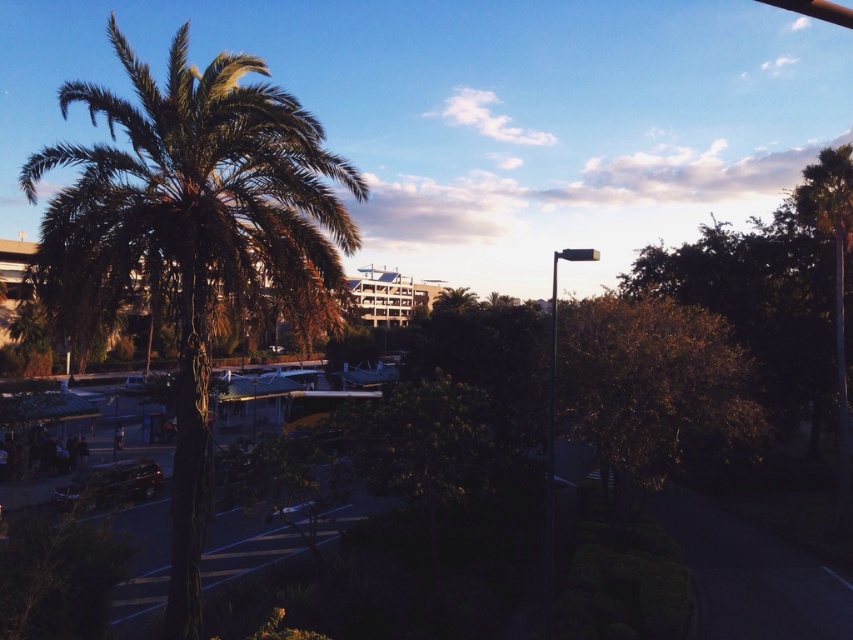
Who is positioned more to the left, green leafy palm tree at left or shiny dark brown car at lower left?

Positioned to the left is green leafy palm tree at left.

Is green leafy palm tree at left positioned before shiny dark brown car at lower left?

Yes.

Is point (287, 198) farther from camera compared to point (68, 483)?

No, it is not.

Identify the location of green leafy palm tree at left. Image resolution: width=853 pixels, height=640 pixels. (194, 234).